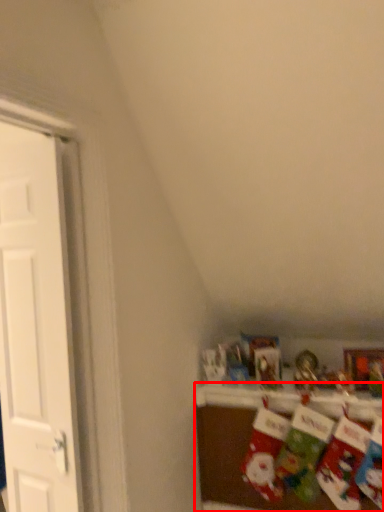
Question: Where is shelf (annotated by the red box) located in relation to door in the image?

Choices:
 (A) right
 (B) left

Answer: (A)